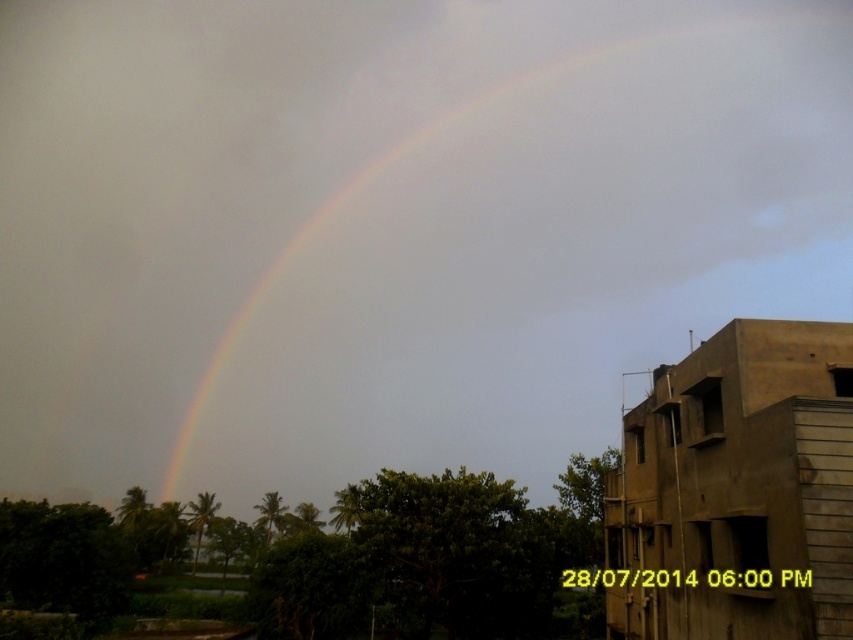
You are an architect designing a new building that needs to fit under the rainbow in the image. Given that the brown concrete building at right is already shorter than the rainbow at center, what should you consider about the height of your new building?

The rainbow at center is much taller than the brown concrete building at right, so your new building should be designed to be shorter than the rainbow at center to ensure it fits under it.

Where is the rainbow at center located in the image?

The rainbow at center is located at point (521, 236).